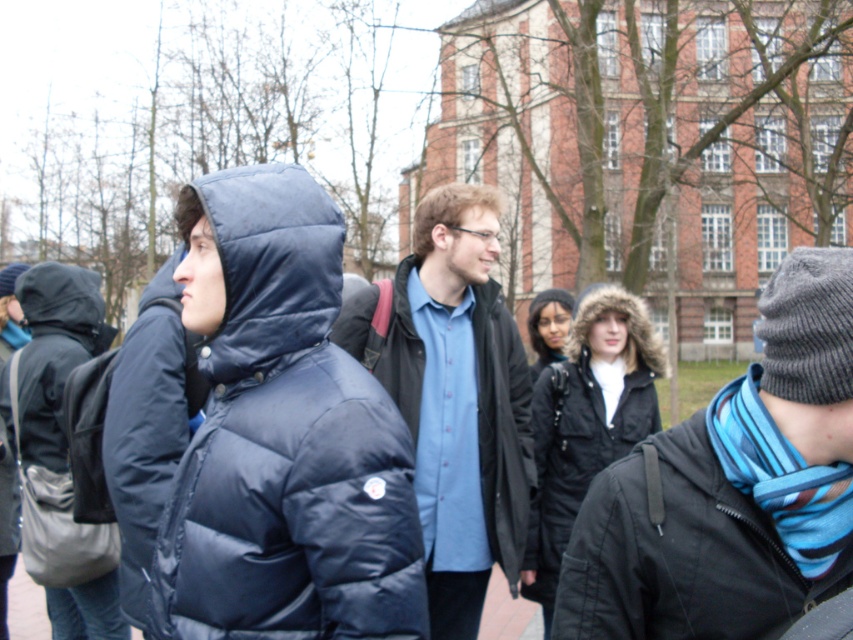
You are organizing a photo shoot and need to ensure that the models wearing the matte blue shirt at center and the matte black coat at left can stand side by side without overlapping. Given their clothing sizes, which model should stand closer to the camera to avoid overlapping?

The matte blue shirt at center has a larger width than the matte black coat at left, so the model wearing the matte blue shirt at center should stand closer to the camera to accommodate their wider garment and prevent overlapping.